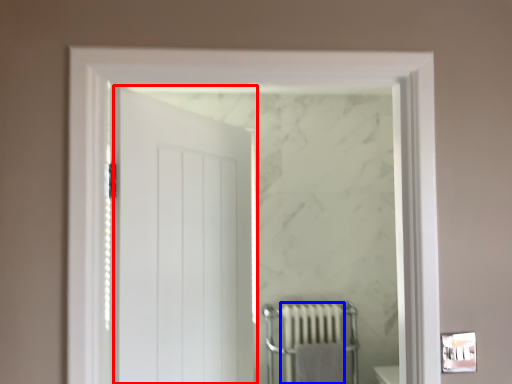
Question: Which of the following is the farthest to the observer, door (highlighted by a red box) or radiator (highlighted by a blue box)?

Choices:
 (A) door
 (B) radiator

Answer: (B)